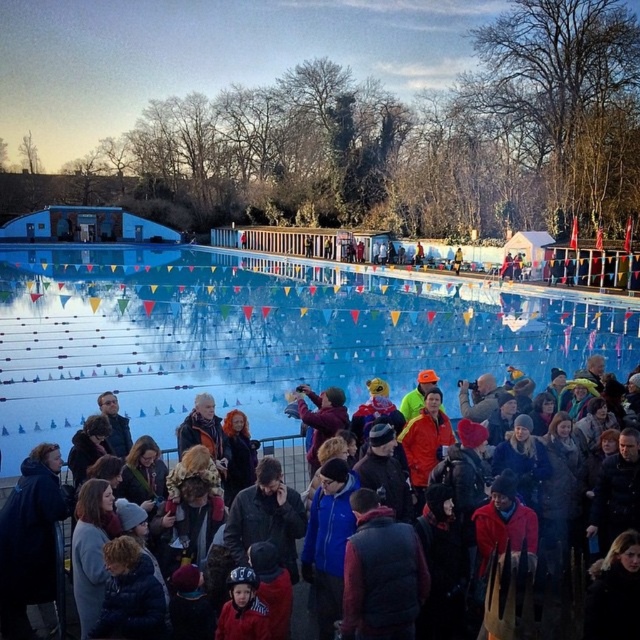
Question: Does blue smooth water at center have a larger size compared to dark blue fabric crowd at lower center?

Choices:
 (A) yes
 (B) no

Answer: (A)

Question: Among these objects, which one is nearest to the camera?

Choices:
 (A) blue smooth water at center
 (B) dark blue fabric crowd at lower center

Answer: (B)

Question: Does blue smooth water at center have a larger size compared to dark blue fabric crowd at lower center?

Choices:
 (A) yes
 (B) no

Answer: (A)

Question: Which object is closer to the camera taking this photo?

Choices:
 (A) dark blue fabric crowd at lower center
 (B) blue smooth water at center

Answer: (A)

Question: Is blue smooth water at center further to camera compared to dark blue fabric crowd at lower center?

Choices:
 (A) no
 (B) yes

Answer: (B)